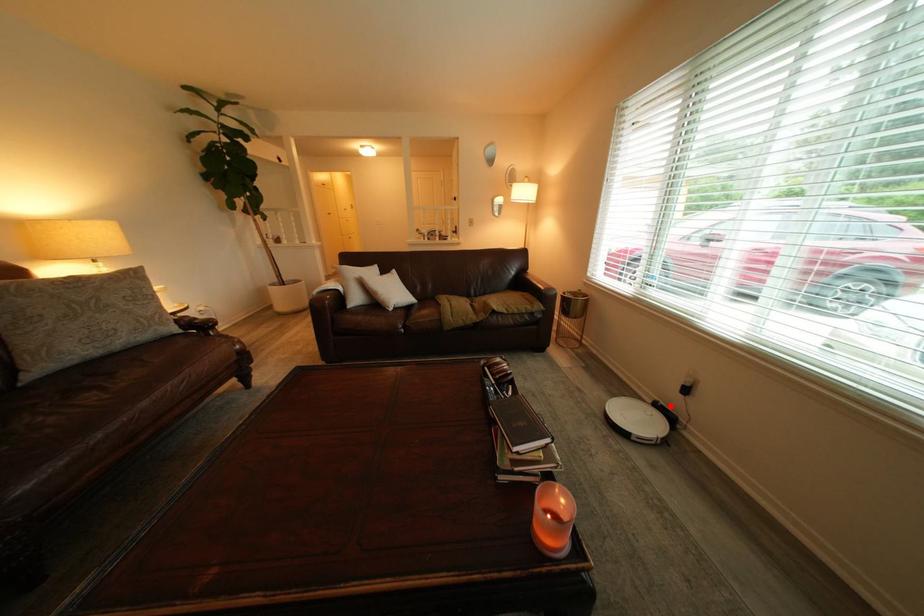
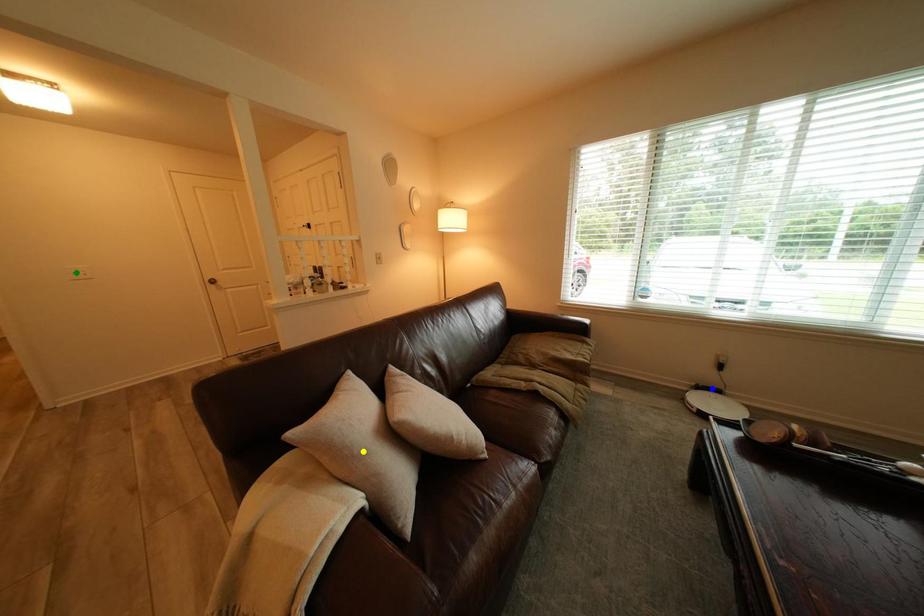
Question: I am providing you with two images of the same scene from different viewpoints. A red point is marked on the first image. You are given multiple points on the second image. Which point in image 2 represents the same 3d spot as the red point in image 1?

Choices:
 (A) green point
 (B) blue point
 (C) yellow point

Answer: (B)